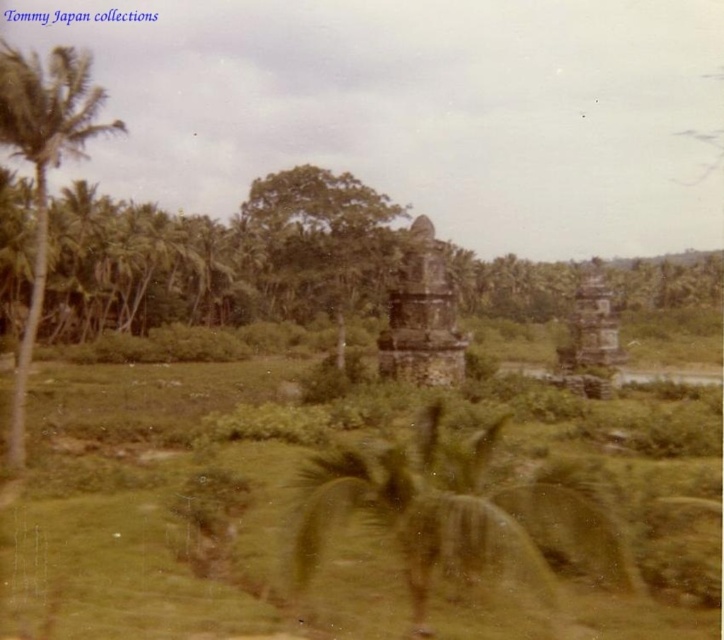
Question: From the image, what is the correct spatial relationship of green leafy palm tree at center in relation to green leafy palm tree at left?

Choices:
 (A) below
 (B) above

Answer: (A)

Question: Which of the following is the closest to the observer?

Choices:
 (A) coord(22,83)
 (B) coord(405,280)
 (C) coord(303,563)

Answer: (C)

Question: Is green leafy palm tree at center smaller than dark brown stone temple at center?

Choices:
 (A) yes
 (B) no

Answer: (B)

Question: Which point appears closest to the camera in this image?

Choices:
 (A) (418, 381)
 (B) (434, 440)

Answer: (B)

Question: Which object is closer to the camera taking this photo?

Choices:
 (A) green leafy palm tree at center
 (B) green leafy palm tree at left
 (C) dark brown stone temple at center

Answer: (A)

Question: Does green leafy palm tree at center appear on the right side of green leafy palm tree at left?

Choices:
 (A) no
 (B) yes

Answer: (B)